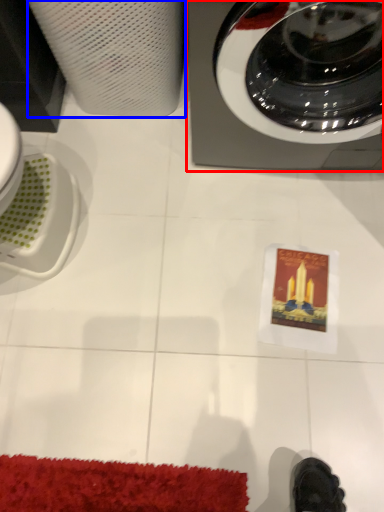
Question: Which object appears closest to the camera in this image, home appliance (highlighted by a red box) or paper towel (highlighted by a blue box)?

Choices:
 (A) home appliance
 (B) paper towel

Answer: (A)